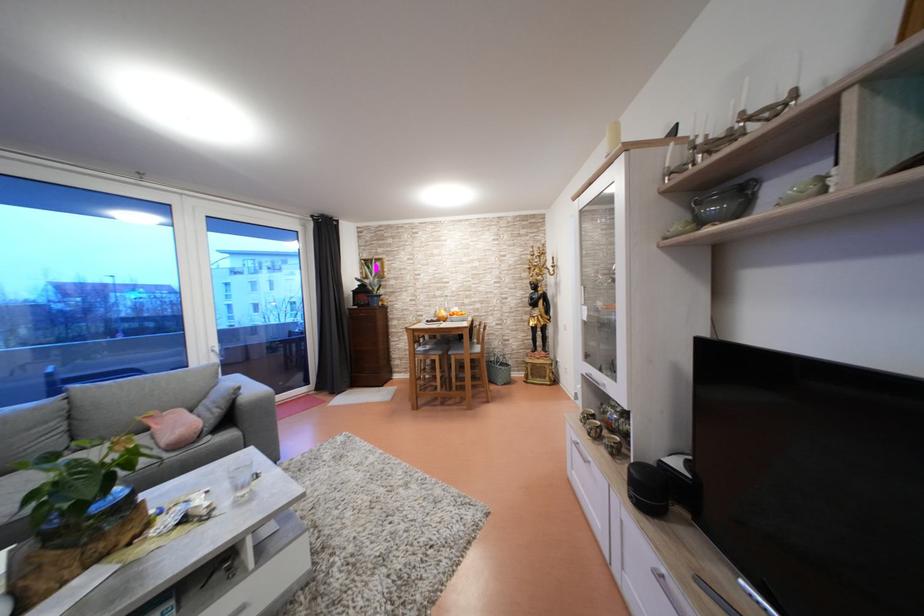
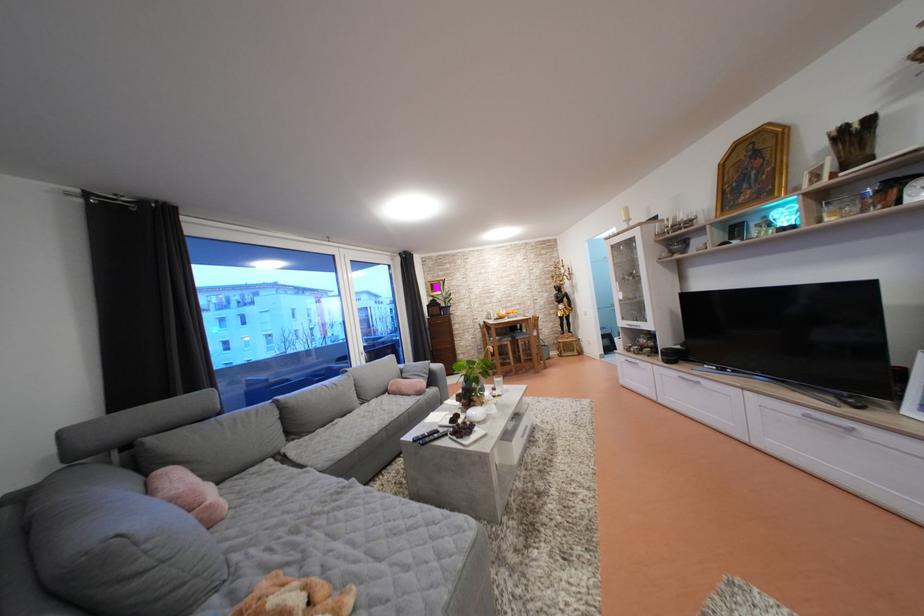
In a continuous first-person perspective shot, in which direction is the camera moving?

The movement direction of the cameraman is left, backward.